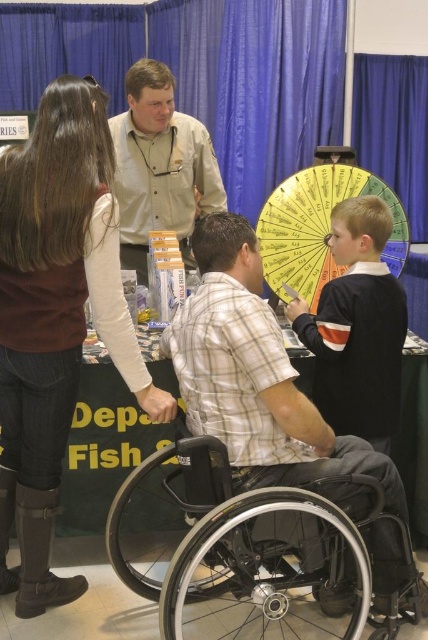
Question: Can you confirm if brown leather boots at lower left is positioned below dark blue sweater at center?

Choices:
 (A) yes
 (B) no

Answer: (A)

Question: Estimate the real-world distances between objects in this image. Which object is farther from the dark blue sweater at center?

Choices:
 (A) metallic silver wheelchair at center
 (B) yellow paper umbrella at center

Answer: (B)

Question: Estimate the real-world distances between objects in this image. Which object is farther from the brown leather boots at lower left?

Choices:
 (A) black plastic wheelchair at lower center
 (B) dark blue sweater at center
 (C) yellow paper umbrella at center

Answer: (C)

Question: Observing the image, what is the correct spatial positioning of khaki button-down shirt at center in reference to yellow paper umbrella at center?

Choices:
 (A) left
 (B) right

Answer: (A)

Question: Considering the relative positions of black plastic wheelchair at lower center and khaki button-down shirt at center in the image provided, where is black plastic wheelchair at lower center located with respect to khaki button-down shirt at center?

Choices:
 (A) left
 (B) right

Answer: (B)

Question: Among these points, which one is farthest from the camera?

Choices:
 (A) (195, 195)
 (B) (379, 424)
 (C) (288, 182)

Answer: (A)